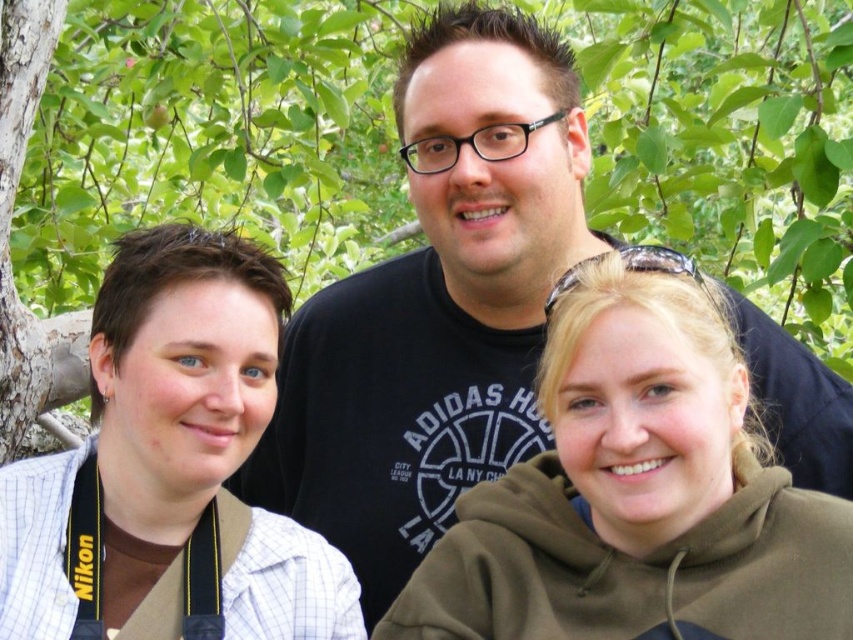
Which of these two, black cotton shirt at center or white checkered shirt at left, stands shorter?

With less height is white checkered shirt at left.

Does point (474, 444) come closer to viewer compared to point (183, 532)?

No, (474, 444) is behind (183, 532).

Does point (328, 476) come closer to viewer compared to point (239, 259)?

No, it is behind (239, 259).

The image size is (853, 640). I want to click on black cotton shirt at center, so click(436, 305).

Does black cotton shirt at center have a greater height compared to green matte hoodie at center?

Yes, black cotton shirt at center is taller than green matte hoodie at center.

Who is positioned more to the left, black cotton shirt at center or green matte hoodie at center?

Positioned to the left is black cotton shirt at center.

Which is in front, point (323, 460) or point (428, 573)?

Positioned in front is point (428, 573).

Identify the location of black cotton shirt at center. Image resolution: width=853 pixels, height=640 pixels. (436, 305).

Does green matte hoodie at center appear on the left side of white checkered shirt at left?

In fact, green matte hoodie at center is to the right of white checkered shirt at left.

Who is positioned more to the right, green matte hoodie at center or white checkered shirt at left?

green matte hoodie at center is more to the right.

Locate an element on the screen. green matte hoodie at center is located at coordinates (637, 493).